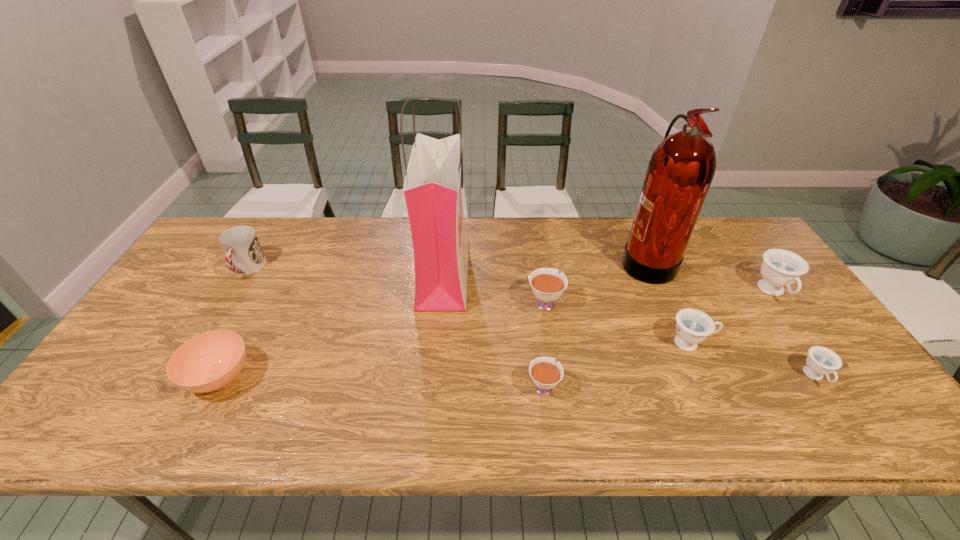
Where is `object at the left edge`? object at the left edge is located at coordinates (244, 255).

I want to click on object located at the far left corner, so click(244, 255).

What are the coordinates of `free location at the far edge` in the screenshot? It's located at (511, 219).

Find the location of a particular element. The image size is (960, 540). vacant area at the near edge of the desktop is located at coordinates (298, 426).

In the image, there is a desktop. In order to click on blank space at the right edge in this screenshot , I will do `click(777, 332)`.

Locate an element on the screen. vacant space at the far right corner of the desktop is located at coordinates (748, 242).

Where is `vacant space in between the smaller white teacup and the red fire extinguisher`? vacant space in between the smaller white teacup and the red fire extinguisher is located at coordinates (594, 323).

Find the location of a particular element. The height and width of the screenshot is (540, 960). free space between the red fire extinguisher and the pink shopping bag is located at coordinates (544, 266).

Identify the location of vacant region between the smaller white teacup and the soup bowl. (381, 381).

You are a GUI agent. You are given a task and a screenshot of the screen. Output one action in this format:
    pyautogui.click(x=<x>, y=<y>)
    Task: Click on the free space between the third object from left to right and the second nearest blue teacup
    The width and height of the screenshot is (960, 540).
    Given the screenshot: What is the action you would take?
    pyautogui.click(x=567, y=307)